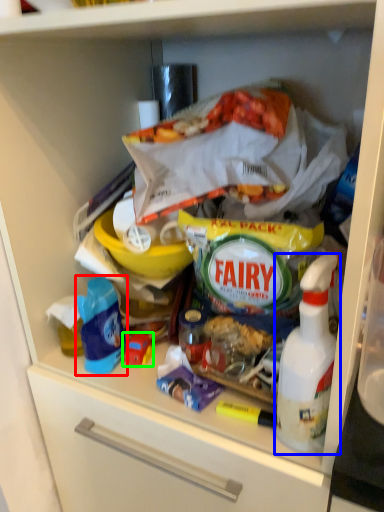
Question: Based on their relative distances, which object is farther from product (highlighted by a red box)? Choose from bottle (highlighted by a blue box) and toy (highlighted by a green box).

Choices:
 (A) bottle
 (B) toy

Answer: (A)